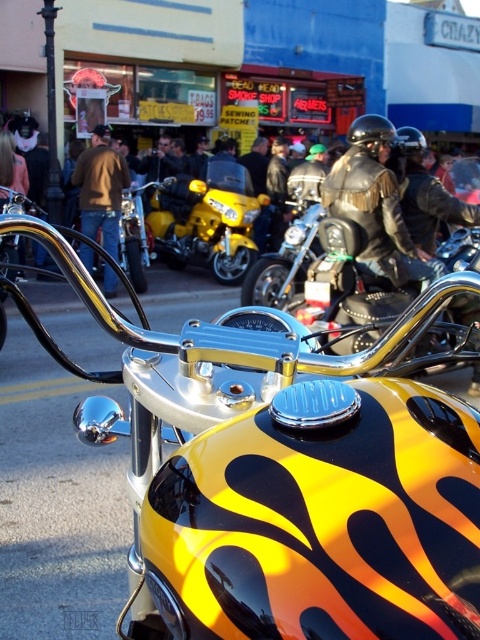
Between point (216, 580) and point (206, 262), which one is positioned behind?

The point (206, 262) is behind.

Between flame-painted chrome motorcycle at center and yellow metallic motorcycle at center, which one has less height?

Standing shorter between the two is flame-painted chrome motorcycle at center.

Find the location of a particular element. The height and width of the screenshot is (640, 480). flame-painted chrome motorcycle at center is located at coordinates (288, 472).

Which is behind, point (381, 269) or point (90, 148)?

The point (90, 148) is more distant.

Who is shorter, leather jacket at center or brown leather jacket at center?

Standing shorter between the two is leather jacket at center.

Is point (407, 236) positioned behind point (98, 202)?

No, (407, 236) is in front of (98, 202).

Identify the location of leather jacket at center. The image size is (480, 640). (375, 204).

Is flame-painted chrome motorcycle at center smaller than brown leather jacket at center?

Yes.

What do you see at coordinates (288, 472) in the screenshot?
I see `flame-painted chrome motorcycle at center` at bounding box center [288, 472].

Locate an element on the screen. flame-painted chrome motorcycle at center is located at coordinates (288, 472).